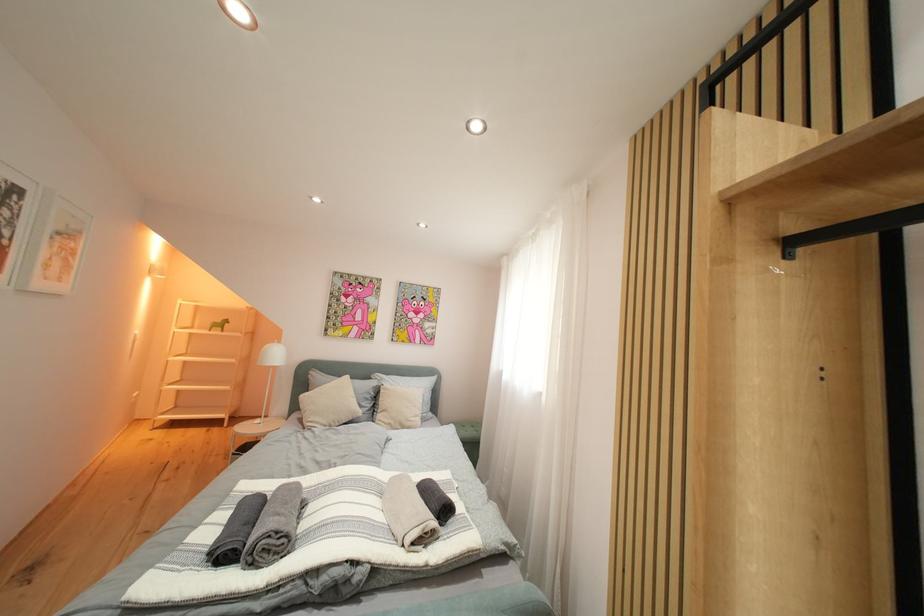
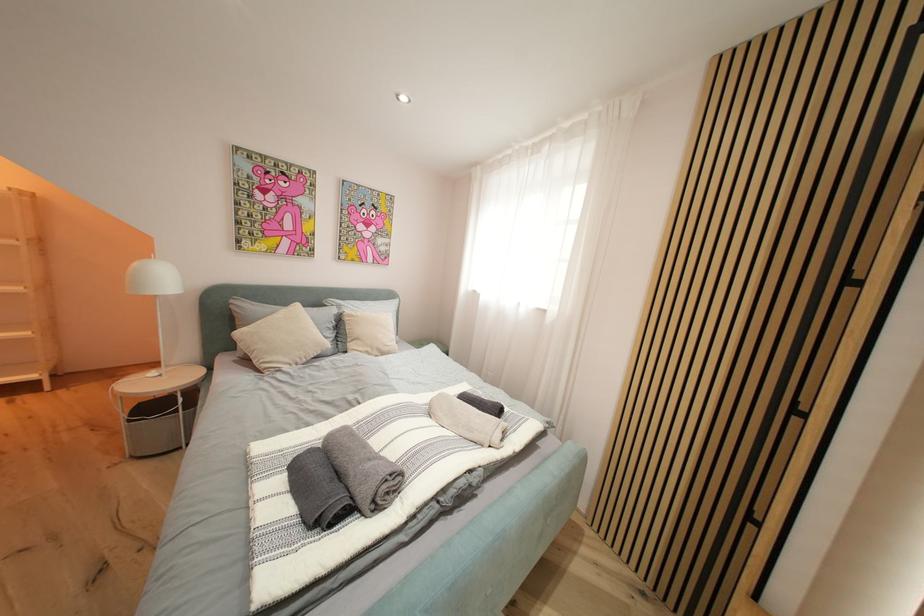
First-person continuous shooting, in which direction is the camera rotating?

The rotation direction of the camera is right-down.